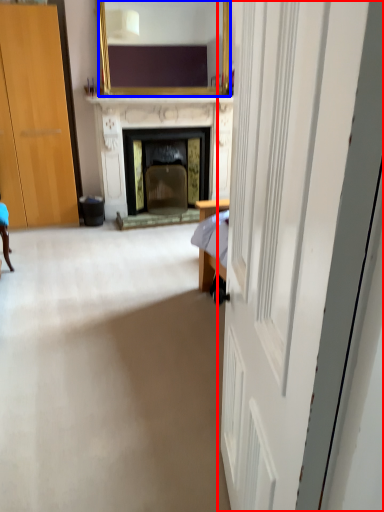
Question: Which point is further to the camera, door (highlighted by a red box) or mirror (highlighted by a blue box)?

Choices:
 (A) door
 (B) mirror

Answer: (B)